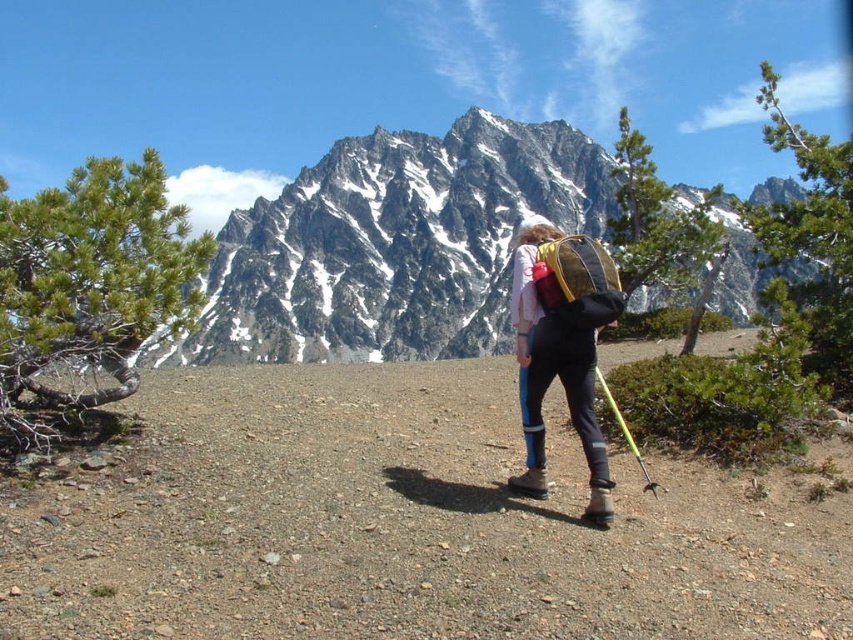
You are a photographer aiming to capture the snowy granite mountain at upper center and the matte black pants at center in the same frame. Which object should you focus on first to ensure both are in sharp focus?

You should focus on the snowy granite mountain at upper center first because it is closer to you than the matte black pants at center, allowing both to be in focus when using a shallow depth of field.

You are a photographer planning to capture the snowy granite mountain at upper center and the matte black pants at center in a single frame. Based on their widths, which object will occupy more space horizontally in the photo?

The snowy granite mountain at upper center will occupy more space horizontally in the photo because its width surpasses that of the matte black pants at center.

You are a photographer trying to capture the snowy granite mountain at upper center in your shot. However, the matte black pants at center are blocking part of the mountain. Can you tell me which object is larger so I know if I should adjust my position to avoid the obstruction?

The snowy granite mountain at upper center is bigger than the matte black pants at center, so adjusting your position might still allow you to capture most of the mountain while minimizing the obstruction from the pants.